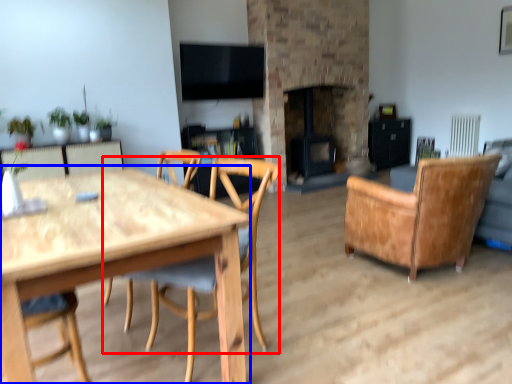
Question: Which point is closer to the camera, chair (highlighted by a red box) or round table (highlighted by a blue box)?

Choices:
 (A) chair
 (B) round table

Answer: (B)